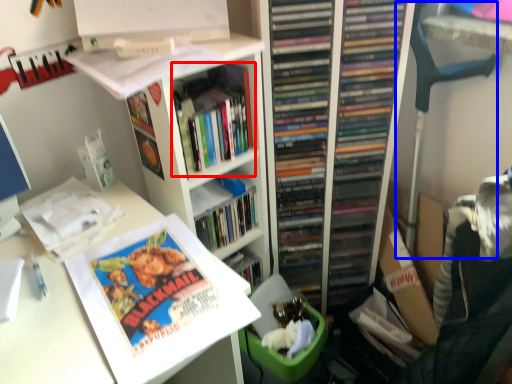
Question: Which of the following is the closest to the observer, book (highlighted by a red box) or computer chair (highlighted by a blue box)?

Choices:
 (A) book
 (B) computer chair

Answer: (A)